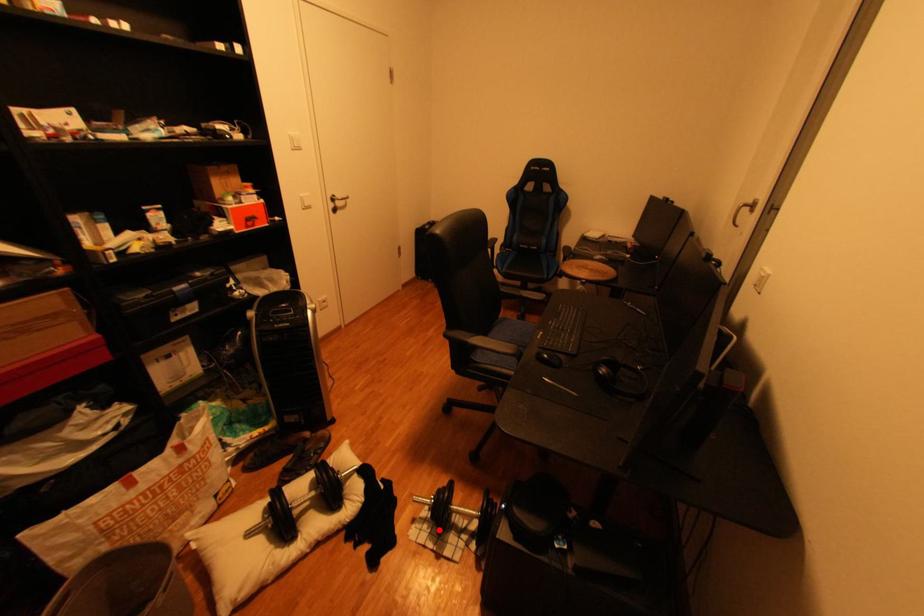
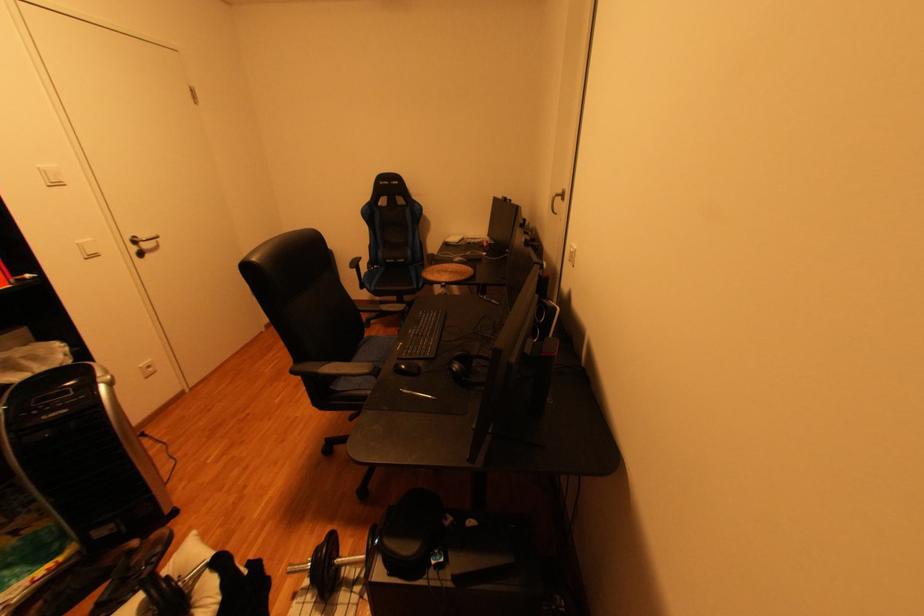
Question: I am providing you with two images of the same scene from different viewpoints. In image1, a red point is highlighted. Considering the same 3D point in image2, which of the following is correct?

Choices:
 (A) It is closer
 (B) It is farther

Answer: (A)